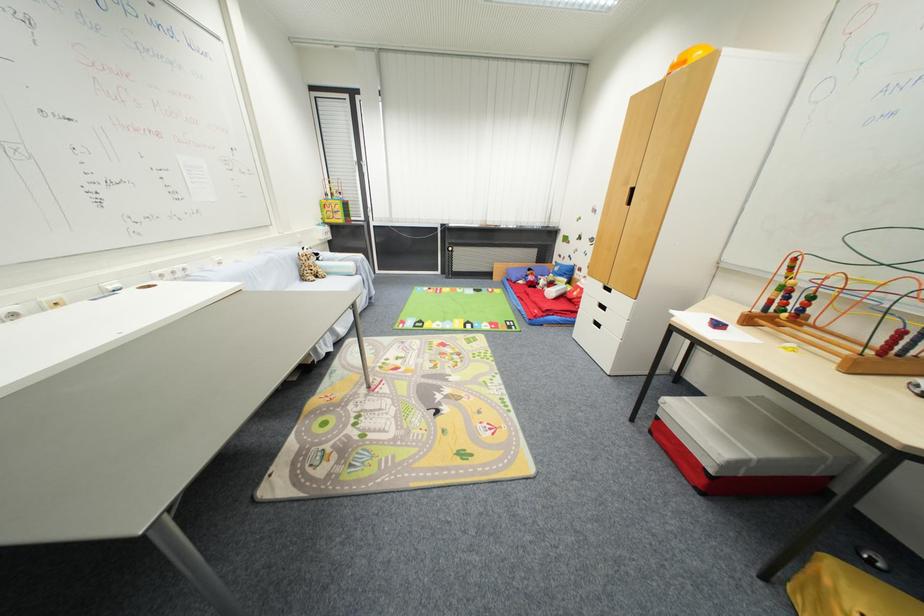
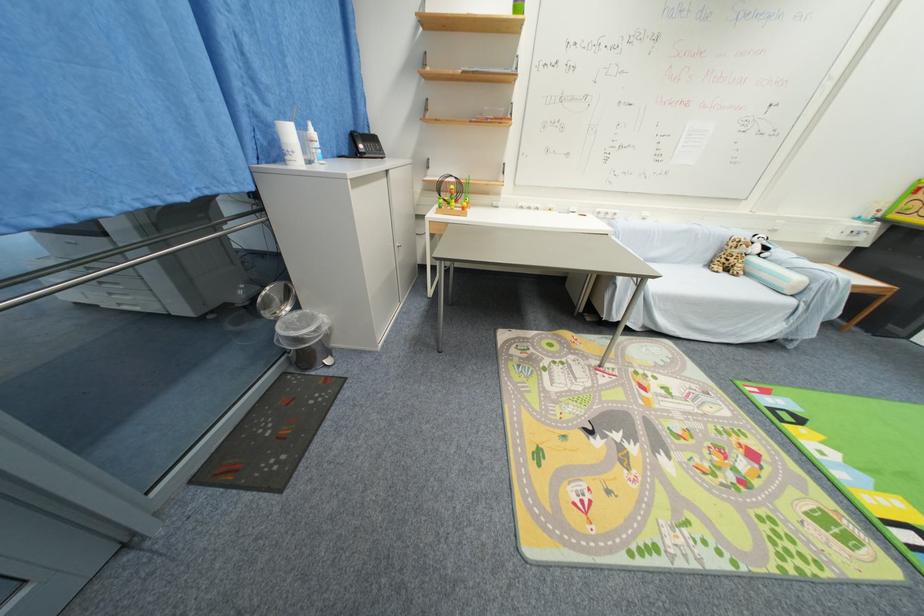
The first image is from the beginning of the video and the second image is from the end. How did the camera likely rotate when shooting the video?

The camera's rotation is toward left-down.